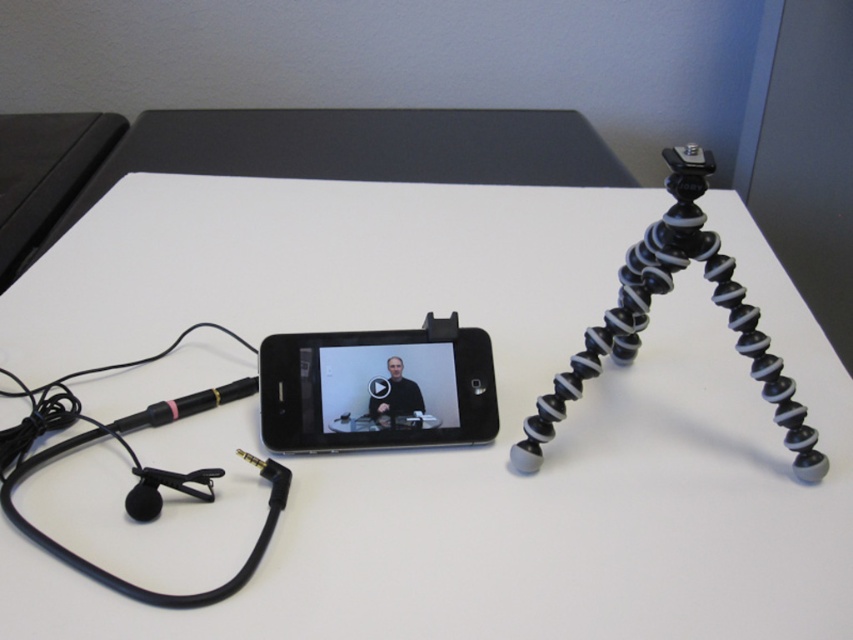
In the scene shown: You are setting up a streaming setup on a desk. You have a black rubberized tripod at right and a black matte video player at center. Which object is positioned higher in the image?

The black rubberized tripod at right is above the black matte video player at center, so it is positioned higher in the image.

Looking at this image, you are setting up a video call and need to position your devices properly. The black rubberized tripod at right and the black matte video player at center are both on the table. Which device should you move if you want to place a new item between them?

You should move the black rubberized tripod at right to the right or the black matte video player at center to the left to create space between them for the new item.

You are setting up a video call and need to place a black matte smartphone at center and a black matte video player at center on a desk. The desk has a width of 12 inches. Can both items fit side by side without overlapping?

The black matte smartphone at center and black matte video player at center are 1.71 inches apart from each other. Since the desk is 12 inches wide, there is sufficient space to place both items side by side without overlapping as the combined width required would be less than 12 inches.